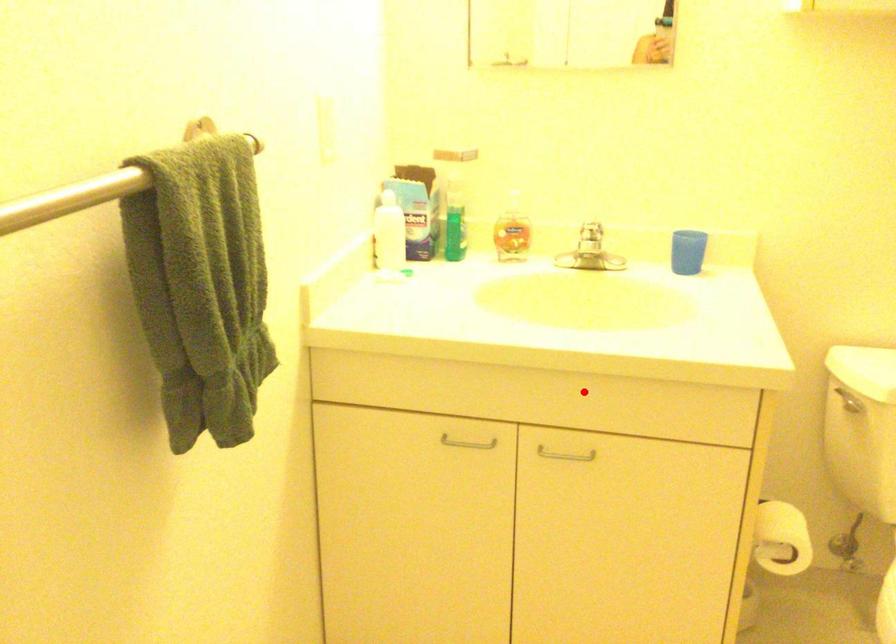
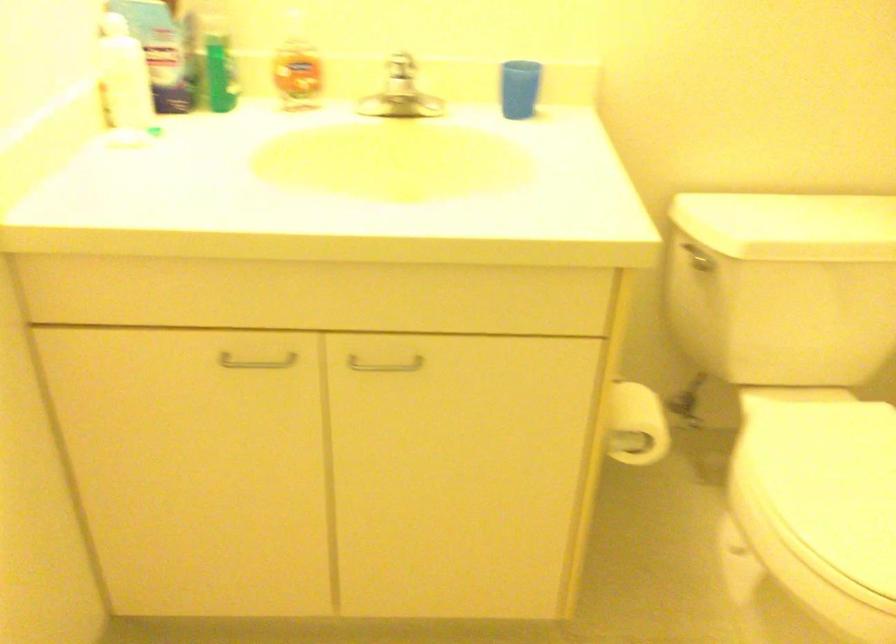
Question: I am providing you with two images of the same scene from different viewpoints. Given a red point in image1, look at the same physical point in image2. Is it:

Choices:
 (A) Closer to the viewpoint
 (B) Farther from the viewpoint

Answer: (A)